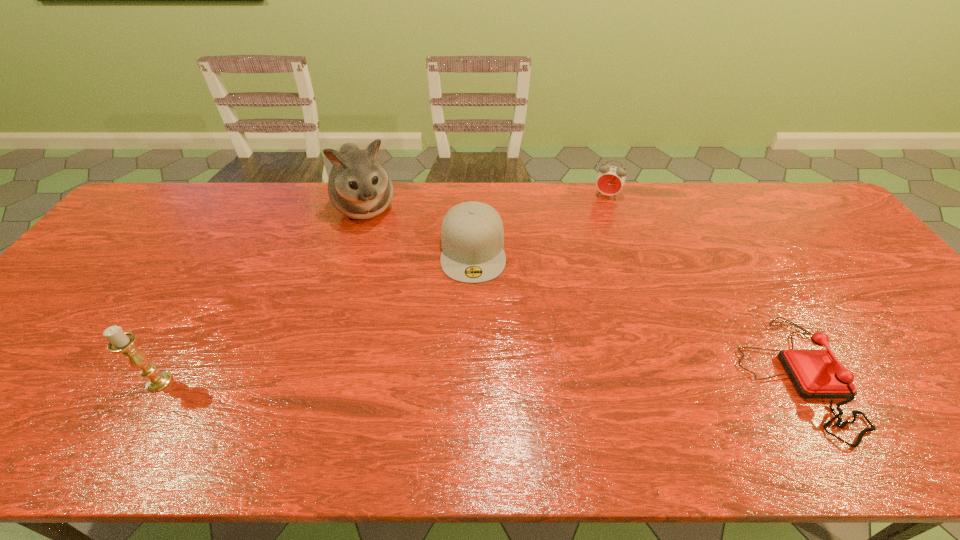
This screenshot has width=960, height=540. In order to click on vacant area located on the right of the second tallest object in this screenshot , I will do `click(274, 382)`.

In order to click on vacant space positioned 0.120m on the dial of the telephone in this screenshot , I will do `click(899, 377)`.

I want to click on free spot located on the face of the fourth object from right to left, so 417,323.

Find the location of a particular element. This screenshot has height=540, width=960. vacant point located on the face of the fourth object from right to left is located at coordinates (398, 287).

The height and width of the screenshot is (540, 960). I want to click on free region located on the face of the fourth object from right to left, so click(x=377, y=240).

Where is `free spot located 0.060m on the face of the second object from right to left`? This screenshot has height=540, width=960. free spot located 0.060m on the face of the second object from right to left is located at coordinates (600, 212).

In order to click on free location located 0.400m on the face of the second object from right to left in this screenshot , I will do `click(574, 283)`.

Where is `vacant space positioned on the face of the second object from right to left`? vacant space positioned on the face of the second object from right to left is located at coordinates (595, 225).

The width and height of the screenshot is (960, 540). I want to click on free region located 0.230m on the front-facing side of the fourth tallest object, so click(475, 354).

This screenshot has height=540, width=960. In order to click on free location located on the front-facing side of the fourth tallest object in this screenshot , I will do `click(475, 341)`.